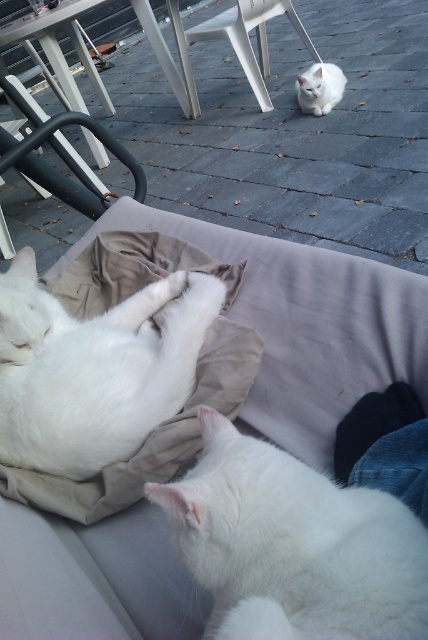
Question: Among these objects, which one is nearest to the camera?

Choices:
 (A) white plastic chair at upper center
 (B) white fluffy cat at center
 (C) velvet beige couch at center
 (D) white fluffy cat at lower right

Answer: (D)

Question: Which is farther from the white fluffy cat at center?

Choices:
 (A) black metal chair at upper left
 (B) white fur cat at upper center

Answer: (B)

Question: Can you confirm if black metal chair at upper left is positioned to the left of white fur cat at upper center?

Choices:
 (A) yes
 (B) no

Answer: (A)

Question: Where is velvet beige couch at center located in relation to white plastic chair at upper center in the image?

Choices:
 (A) above
 (B) below

Answer: (B)

Question: Which object is farther from the camera taking this photo?

Choices:
 (A) velvet beige couch at center
 (B) white fluffy cat at center
 (C) black metal chair at upper left

Answer: (C)

Question: Considering the relative positions of white fluffy cat at center and white plastic chair at upper center in the image provided, where is white fluffy cat at center located with respect to white plastic chair at upper center?

Choices:
 (A) above
 (B) below

Answer: (B)